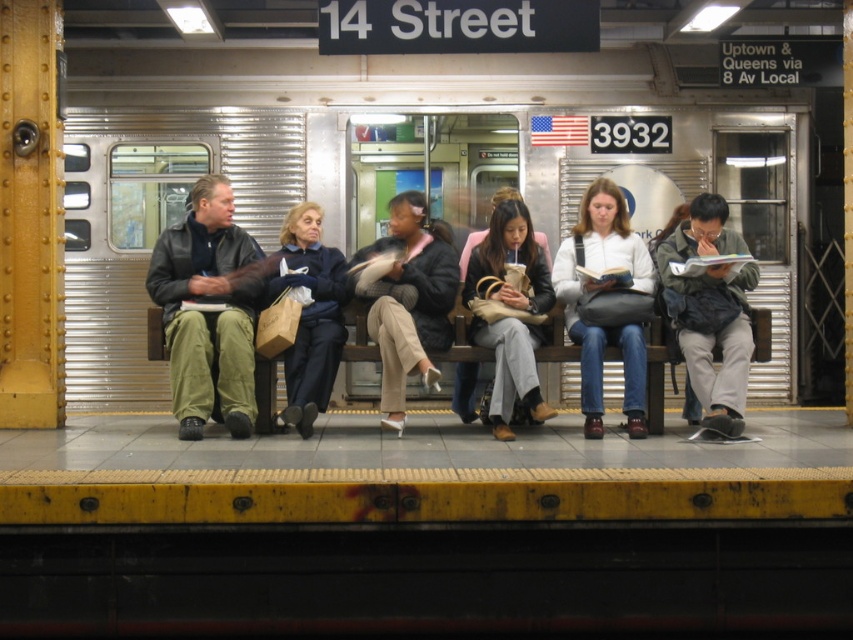
Looking at this image, you are a passenger waiting at the subway station platform. You notice the silver metallic train at center and the matte olive green pants at left. Which object is closer to you as you stand on the platform?

The silver metallic train at center is closer to you because the matte olive green pants at left is behind it.

You are a commuter waiting for the train at the subway station. You see a black leather jacket at center and a dark blue sweater at center. Which item is taller?

The black leather jacket at center is much taller than the dark blue sweater at center.

You are standing on the subway platform at the 14 Street station. You notice two points marked on the platform floor. The first point is at coordinates point (399, 332) and the second is at point (299, 388). Which point is nearer to you?

Point (399, 332) is closer to the viewer than point (299, 388).